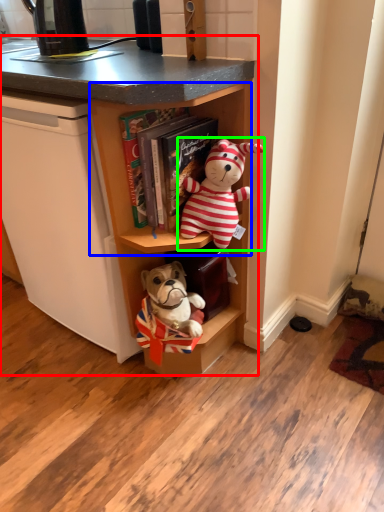
Question: Which object is positioned closest to cabinetry (highlighted by a red box)? Select from cabinet (highlighted by a blue box) and toy (highlighted by a green box).

Choices:
 (A) cabinet
 (B) toy

Answer: (A)